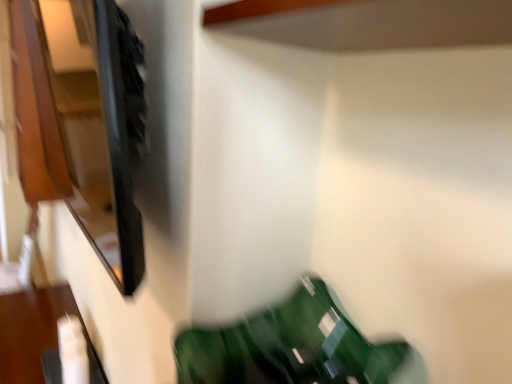
Question: Considering the relative sizes of green glossy bean bag chair at lower center and matte black cabinet at upper left in the image provided, is green glossy bean bag chair at lower center bigger than matte black cabinet at upper left?

Choices:
 (A) no
 (B) yes

Answer: (A)

Question: Does green glossy bean bag chair at lower center have a greater height compared to matte black cabinet at upper left?

Choices:
 (A) yes
 (B) no

Answer: (B)

Question: Considering the relative sizes of green glossy bean bag chair at lower center and matte black cabinet at upper left in the image provided, is green glossy bean bag chair at lower center thinner than matte black cabinet at upper left?

Choices:
 (A) yes
 (B) no

Answer: (B)

Question: Could you tell me if green glossy bean bag chair at lower center is turned towards matte black cabinet at upper left?

Choices:
 (A) yes
 (B) no

Answer: (B)

Question: Is green glossy bean bag chair at lower center to the left of matte black cabinet at upper left from the viewer's perspective?

Choices:
 (A) yes
 (B) no

Answer: (B)

Question: From a real-world perspective, is matte black cabinet at upper left above or below white glossy remote control at lower left?

Choices:
 (A) below
 (B) above

Answer: (B)

Question: In terms of height, does matte black cabinet at upper left look taller or shorter compared to white glossy remote control at lower left?

Choices:
 (A) short
 (B) tall

Answer: (B)

Question: Considering the positions of point (17, 61) and point (55, 296), is point (17, 61) closer or farther from the camera than point (55, 296)?

Choices:
 (A) closer
 (B) farther

Answer: (B)

Question: Is matte black cabinet at upper left to the left or to the right of white glossy remote control at lower left in the image?

Choices:
 (A) left
 (B) right

Answer: (B)

Question: From the image's perspective, is green glossy bean bag chair at lower center above or below white glossy remote control at lower left?

Choices:
 (A) below
 (B) above

Answer: (B)

Question: Considering the positions of point (256, 342) and point (28, 360), is point (256, 342) closer or farther from the camera than point (28, 360)?

Choices:
 (A) closer
 (B) farther

Answer: (A)

Question: In terms of height, does green glossy bean bag chair at lower center look taller or shorter compared to white glossy remote control at lower left?

Choices:
 (A) short
 (B) tall

Answer: (A)

Question: Is green glossy bean bag chair at lower center inside the boundaries of white glossy remote control at lower left, or outside?

Choices:
 (A) inside
 (B) outside

Answer: (B)

Question: Is matte black cabinet at upper left wider or thinner than green glossy bean bag chair at lower center?

Choices:
 (A) wide
 (B) thin

Answer: (B)

Question: Is matte black cabinet at upper left inside the boundaries of green glossy bean bag chair at lower center, or outside?

Choices:
 (A) outside
 (B) inside

Answer: (A)